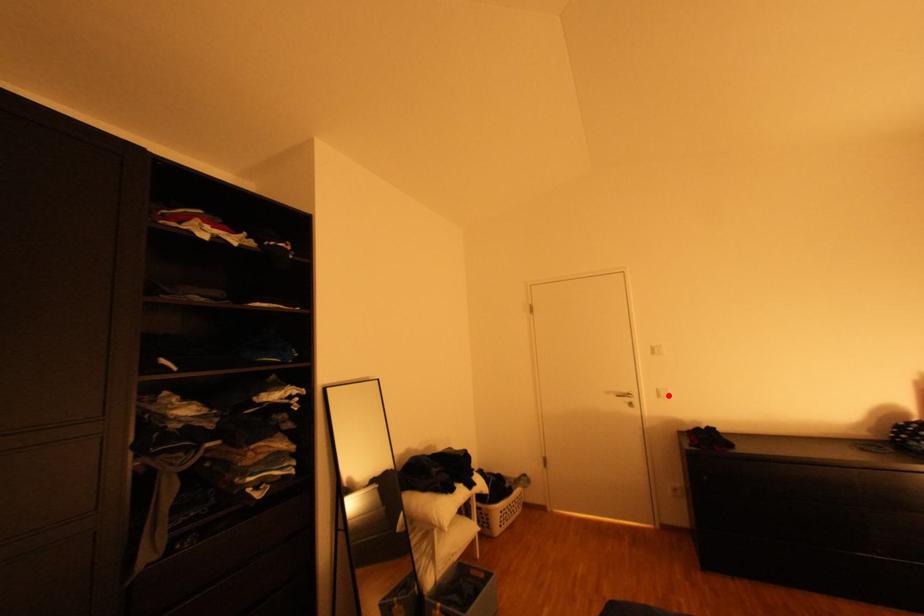
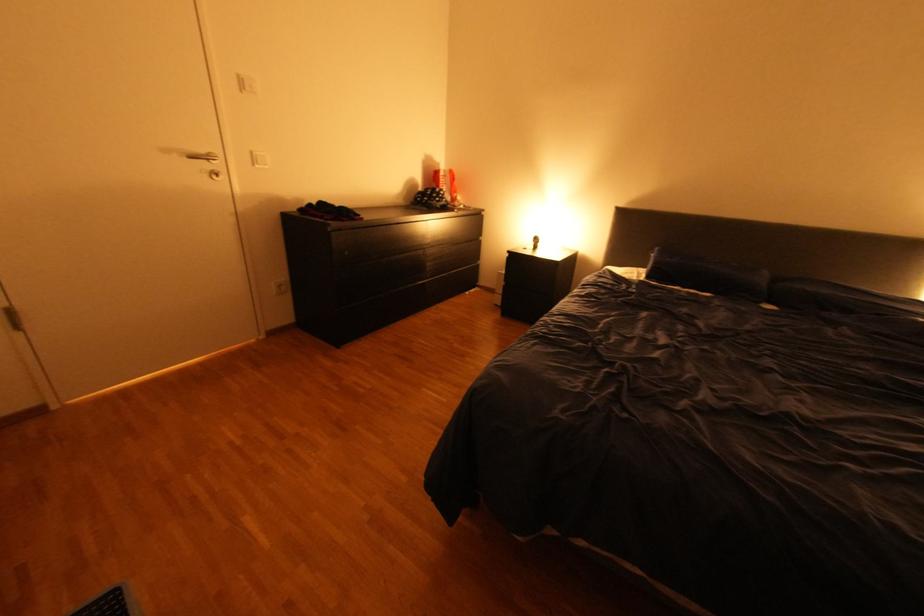
The point at the highlighted location is marked in the first image. Where is the corresponding point in the second image?

(264, 161)